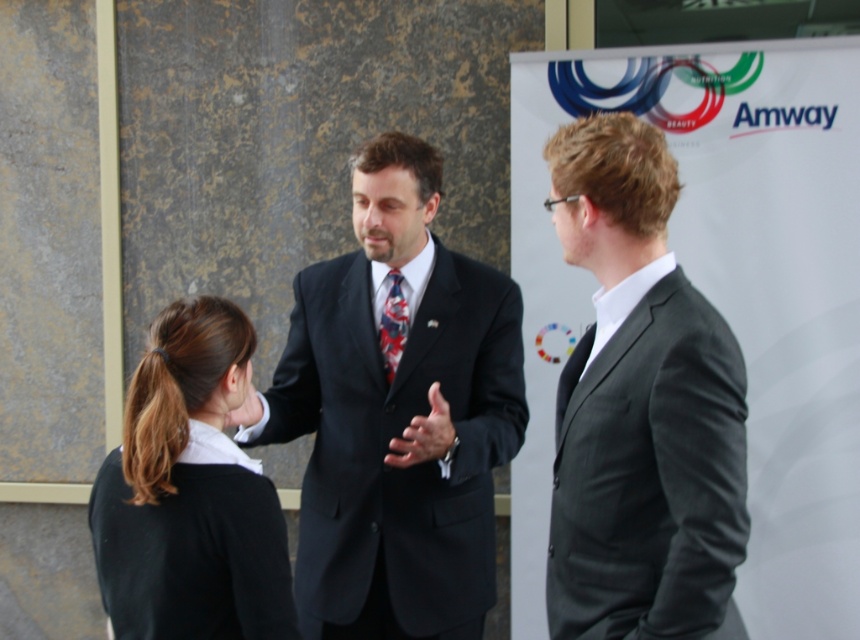
Which is in front, point (281, 573) or point (388, 301)?

Positioned in front is point (281, 573).

This screenshot has width=860, height=640. I want to click on black sweater at center, so tap(189, 493).

Does dark gray suit at right have a lesser width compared to black sweater at center?

Correct, dark gray suit at right's width is less than black sweater at center's.

Is dark gray suit at right to the left of black sweater at center from the viewer's perspective?

No, dark gray suit at right is not to the left of black sweater at center.

From the picture: Who is more forward, [665,637] or [146,374]?

Point [665,637]

In order to click on dark gray suit at right in this screenshot , I will do `click(640, 410)`.

Can you confirm if black sweater at center is positioned to the left of matte black hand at center?

Indeed, black sweater at center is positioned on the left side of matte black hand at center.

Which is in front, point (169, 529) or point (452, 433)?

Positioned in front is point (169, 529).

The height and width of the screenshot is (640, 860). Identify the location of black sweater at center. (189, 493).